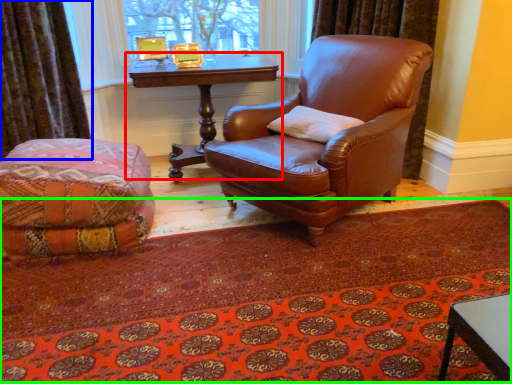
Question: Which is farther away from table (highlighted by a red box)? curtain (highlighted by a blue box) or mat (highlighted by a green box)?

Choices:
 (A) curtain
 (B) mat

Answer: (B)